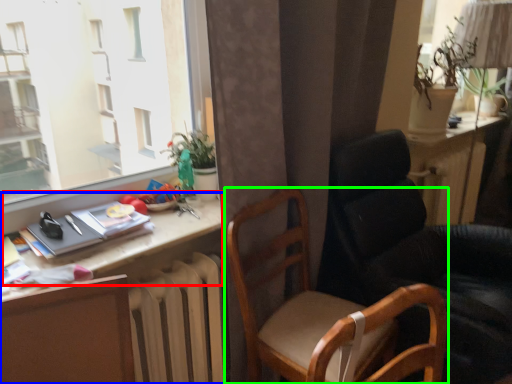
Question: Which object is positioned farthest from table (highlighted by a red box)? Select from desk (highlighted by a blue box) and chair (highlighted by a green box).

Choices:
 (A) desk
 (B) chair

Answer: (B)